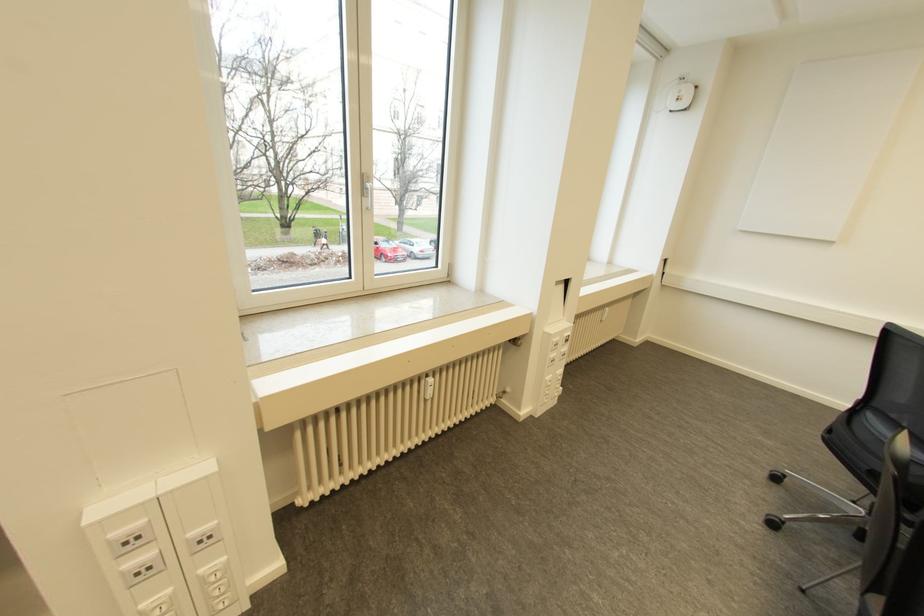
Where would you press the white light switch? Please return your answer as a coordinate pair (x, y).

(168, 546)